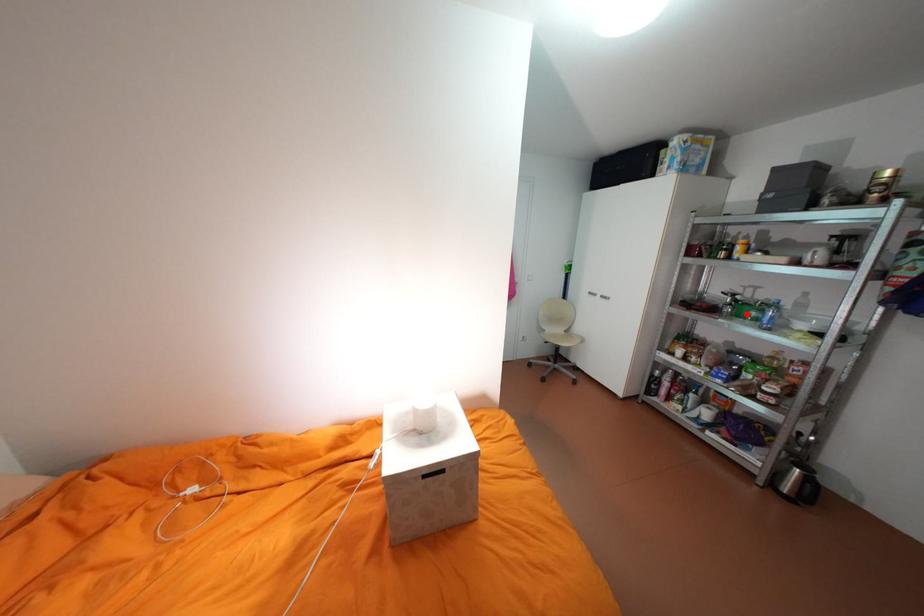
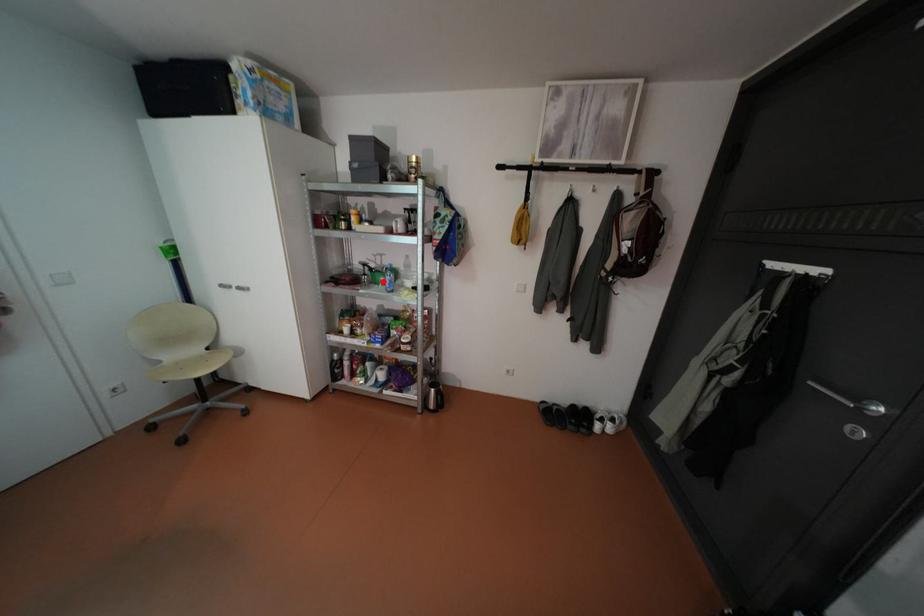
I am providing you with two images of the same scene from different viewpoints. A red point is marked on the first image and another point is marked on the second image. Is the marked point in image1 the same physical position as the marked point in image2?

Yes